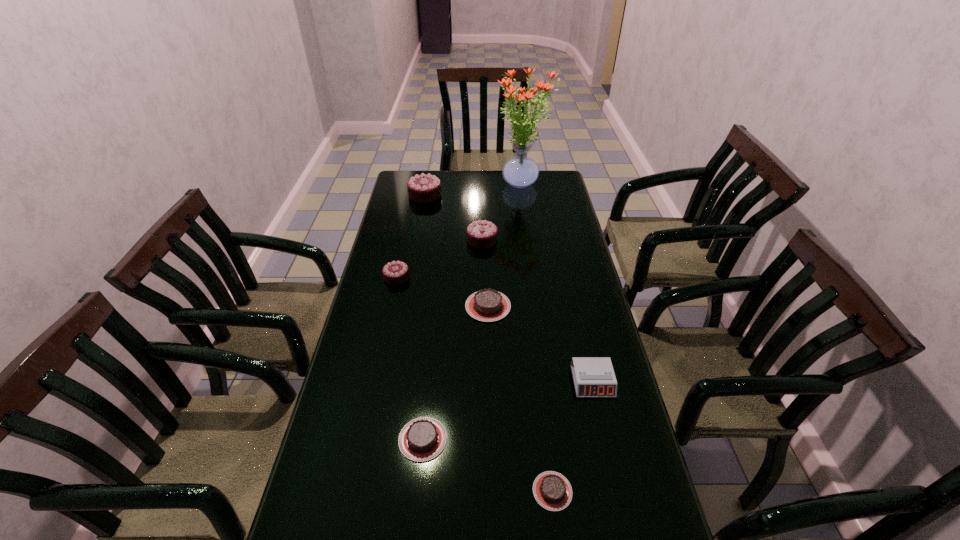
The image size is (960, 540). I want to click on vacant area at the left edge, so click(376, 255).

Image resolution: width=960 pixels, height=540 pixels. Find the location of `vacant space at the right edge of the desktop`. vacant space at the right edge of the desktop is located at coordinates (560, 245).

At what (x,y) coordinates should I click in order to perform the action: click on vacant region at the far right corner. Please return your answer as a coordinate pair (x, y). Image resolution: width=960 pixels, height=540 pixels. Looking at the image, I should click on (537, 193).

Locate an element on the screen. This screenshot has height=540, width=960. free spot between the fourth tallest chocolate cake and the fifth tallest chocolate cake is located at coordinates (455, 373).

Locate an element on the screen. This screenshot has height=540, width=960. unoccupied area between the alarm clock and the third farthest object is located at coordinates (538, 310).

This screenshot has width=960, height=540. Find the location of `free spot between the shortest object and the farthest chocolate chocolate cake`. free spot between the shortest object and the farthest chocolate chocolate cake is located at coordinates (489, 343).

The height and width of the screenshot is (540, 960). In order to click on vacant area that lies between the tallest object and the third nearest object in this screenshot , I will do `click(558, 282)`.

Identify the location of free area in between the sixth farthest object and the nearest chocolate chocolate cake. (494, 329).

What are the coordinates of `vacant area that lies between the second tallest object and the fifth shortest chocolate cake` in the screenshot? It's located at (453, 218).

Where is `free point between the farthest chocolate chocolate cake and the red flower arrangement`? free point between the farthest chocolate chocolate cake and the red flower arrangement is located at coordinates (473, 190).